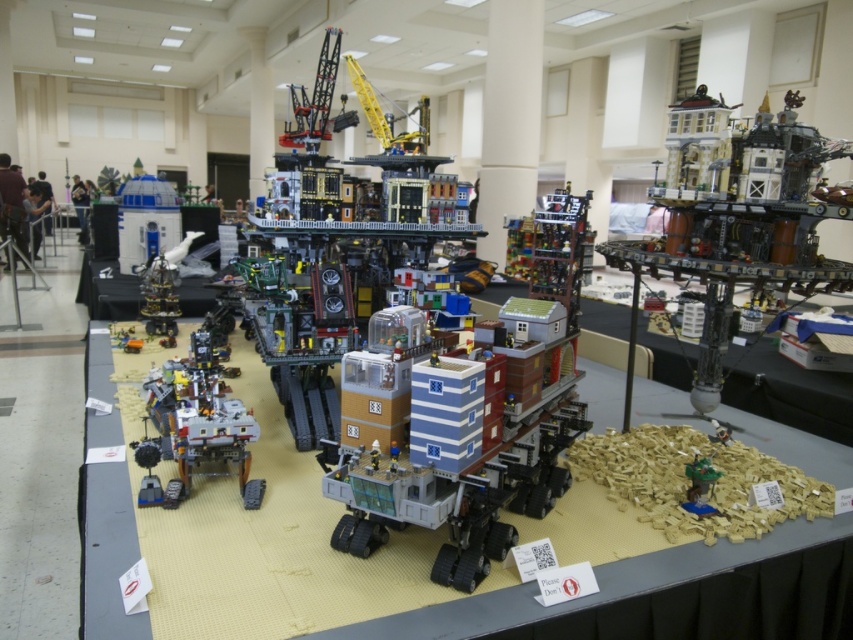
This screenshot has width=853, height=640. Identify the location of matte plastic rover at center. (466, 449).

Does matte plastic rover at center appear over brickwork tower at upper right?

Actually, matte plastic rover at center is below brickwork tower at upper right.

Where is `matte plastic rover at center`? The width and height of the screenshot is (853, 640). matte plastic rover at center is located at coordinates pyautogui.click(x=466, y=449).

Can you confirm if brickwork tower at upper right is taller than clear plastic tower at center-left?

Yes.

Is brickwork tower at upper right to the left of clear plastic tower at center-left from the viewer's perspective?

Incorrect, brickwork tower at upper right is not on the left side of clear plastic tower at center-left.

At what (x,y) coordinates should I click in order to perform the action: click on brickwork tower at upper right. Please return your answer as a coordinate pair (x, y). Looking at the image, I should click on (740, 234).

What do you see at coordinates (466, 449) in the screenshot? Image resolution: width=853 pixels, height=640 pixels. I see `matte plastic rover at center` at bounding box center [466, 449].

Describe the element at coordinates (466, 449) in the screenshot. I see `matte plastic rover at center` at that location.

The width and height of the screenshot is (853, 640). In order to click on matte plastic rover at center in this screenshot , I will do `click(466, 449)`.